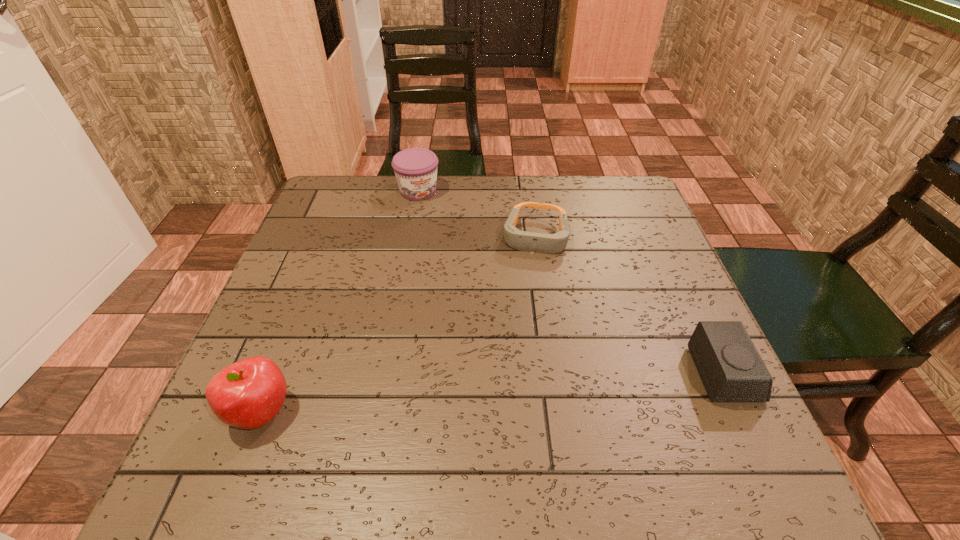
Locate an element on the screen. Image resolution: width=960 pixels, height=540 pixels. free space between the second shortest object and the shortest object is located at coordinates (630, 306).

Identify the location of vacant region between the second tallest object and the apple. This screenshot has width=960, height=540. (340, 301).

The width and height of the screenshot is (960, 540). Identify the location of free point between the shortest object and the jam. (476, 214).

The height and width of the screenshot is (540, 960). Identify the location of blank region between the jam and the alarm clock. (572, 282).

Where is `free space between the rightmost object and the tallest object`? The height and width of the screenshot is (540, 960). free space between the rightmost object and the tallest object is located at coordinates (493, 393).

Image resolution: width=960 pixels, height=540 pixels. I want to click on vacant space in between the farthest object and the tallest object, so click(340, 301).

Identify the location of unoccupied area between the second object from left to right and the second farthest object. (476, 214).

At what (x,y) coordinates should I click in order to perform the action: click on vacant space in between the tallest object and the rightmost object. Please return your answer as a coordinate pair (x, y). The height and width of the screenshot is (540, 960). Looking at the image, I should click on (493, 393).

What are the coordinates of `vacant space in between the jam and the leftmost object` in the screenshot? It's located at (340, 301).

Where is `object identified as the third closest to the apple`? object identified as the third closest to the apple is located at coordinates (731, 369).